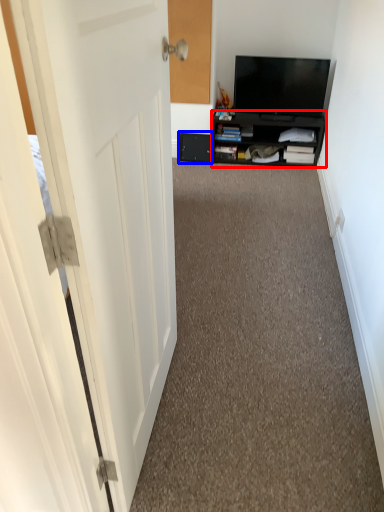
Question: Which of the following is the farthest to the observer, cabinetry (highlighted by a red box) or drawer (highlighted by a blue box)?

Choices:
 (A) cabinetry
 (B) drawer

Answer: (B)